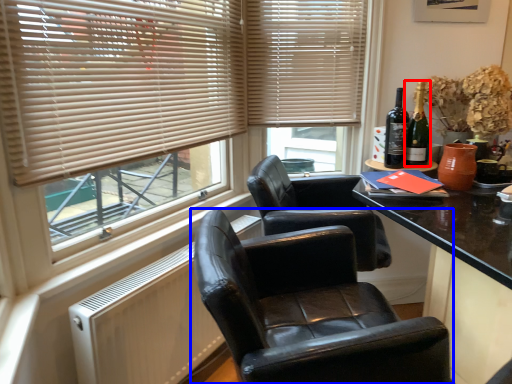
Question: Which object is closer to the camera taking this photo, bottle (highlighted by a red box) or chair (highlighted by a blue box)?

Choices:
 (A) bottle
 (B) chair

Answer: (B)